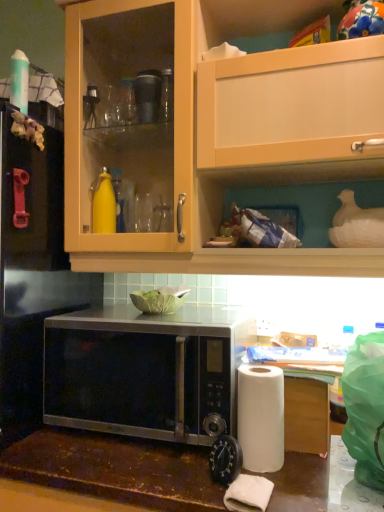
Question: Is black matte microwave at lower center closer to camera compared to white matte paper towel at lower right?

Choices:
 (A) no
 (B) yes

Answer: (A)

Question: Can you confirm if black matte microwave at lower center is thinner than white matte paper towel at lower right?

Choices:
 (A) no
 (B) yes

Answer: (A)

Question: Is black matte microwave at lower center smaller than white matte paper towel at lower right?

Choices:
 (A) yes
 (B) no

Answer: (B)

Question: Can you confirm if black matte microwave at lower center is taller than white matte paper towel at lower right?

Choices:
 (A) no
 (B) yes

Answer: (B)

Question: Can you confirm if black matte microwave at lower center is shorter than white matte paper towel at lower right?

Choices:
 (A) no
 (B) yes

Answer: (A)

Question: From the image's perspective, is black matte microwave at lower center located beneath white matte paper towel at lower right?

Choices:
 (A) no
 (B) yes

Answer: (A)

Question: Can you confirm if white paper at lower right is thinner than white matte paper towel at lower right?

Choices:
 (A) no
 (B) yes

Answer: (A)

Question: From the image's perspective, would you say white paper at lower right is shown under white matte paper towel at lower right?

Choices:
 (A) no
 (B) yes

Answer: (B)

Question: From a real-world perspective, is white paper at lower right under white matte paper towel at lower right?

Choices:
 (A) no
 (B) yes

Answer: (B)

Question: Could you tell me if white paper at lower right is turned towards white matte paper towel at lower right?

Choices:
 (A) yes
 (B) no

Answer: (A)

Question: Considering the relative sizes of white paper at lower right and white matte paper towel at lower right in the image provided, is white paper at lower right wider than white matte paper towel at lower right?

Choices:
 (A) no
 (B) yes

Answer: (B)

Question: Is white paper at lower right looking in the opposite direction of white matte paper towel at lower right?

Choices:
 (A) no
 (B) yes

Answer: (A)

Question: Does black metallic microwave at center have a larger size compared to white matte paper towel at lower right?

Choices:
 (A) no
 (B) yes

Answer: (B)